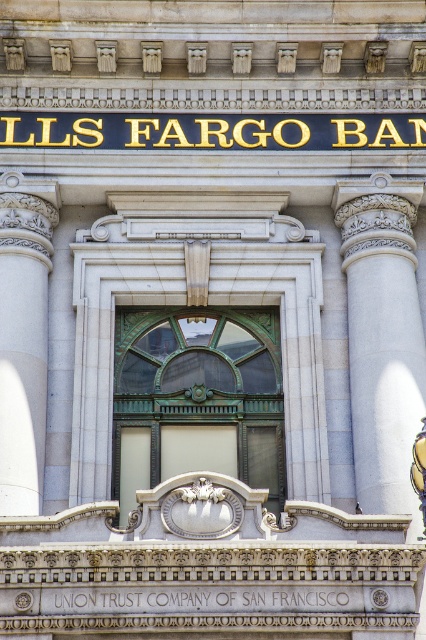
Question: Where is white marble column at right located in relation to gold metallic sign at upper center in the image?

Choices:
 (A) right
 (B) left

Answer: (A)

Question: Estimate the real-world distances between objects in this image. Which object is closer to the black stone text at center?

Choices:
 (A) white marble column at left
 (B) white marble column at right
 (C) gold metallic sign at upper center

Answer: (A)

Question: Is gold metallic sign at upper center to the right of black stone text at center from the viewer's perspective?

Choices:
 (A) yes
 (B) no

Answer: (A)

Question: Which of these objects is positioned closest to the green glass door at center?

Choices:
 (A) black stone text at center
 (B) white marble column at left
 (C) gold metallic sign at upper center
 (D) white marble column at right

Answer: (D)

Question: Is green glass door at center below black stone text at center?

Choices:
 (A) yes
 (B) no

Answer: (B)

Question: Which object is the closest to the black stone text at center?

Choices:
 (A) white marble column at right
 (B) green glass door at center
 (C) white marble column at left
 (D) gold metallic sign at upper center

Answer: (C)